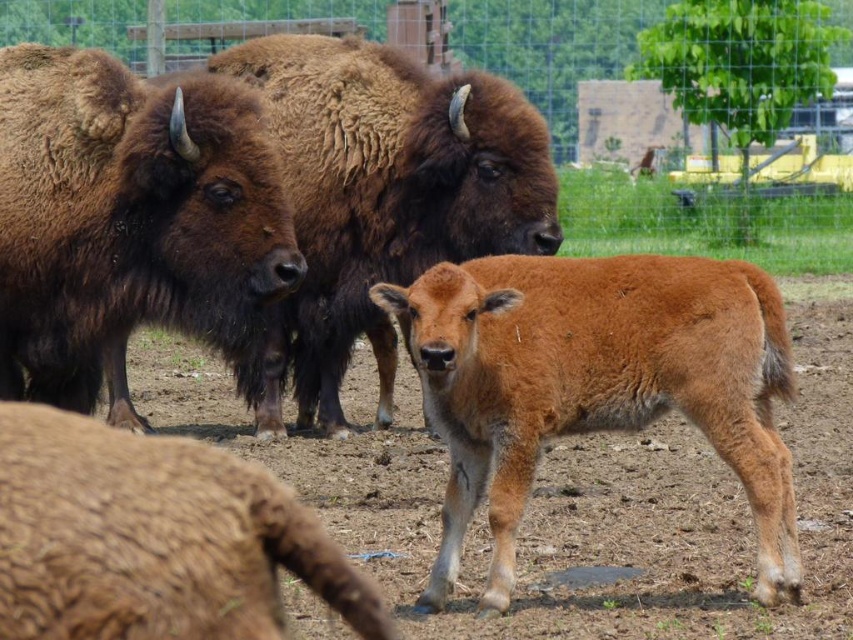
Question: Considering the relative positions of brown furry calf at center and brown furry bison at center in the image provided, where is brown furry calf at center located with respect to brown furry bison at center?

Choices:
 (A) below
 (B) above

Answer: (A)

Question: Which of these objects is positioned closest to the brown furry bison at center?

Choices:
 (A) brown fuzzy bison at upper left
 (B) brown fuzzy calf at center

Answer: (A)

Question: Which of these objects is positioned farthest from the brown fuzzy bison at upper left?

Choices:
 (A) brown furry calf at center
 (B) wire mesh fence at upper center
 (C) brown fuzzy calf at center
 (D) brown furry bison at center

Answer: (B)

Question: Is brown furry bison at center below brown fuzzy calf at center?

Choices:
 (A) yes
 (B) no

Answer: (B)

Question: Which point is farther to the camera?

Choices:
 (A) (180, 310)
 (B) (407, 76)
 (C) (503, 28)
 (D) (64, 422)

Answer: (C)

Question: Is brown furry calf at center smaller than wire mesh fence at upper center?

Choices:
 (A) no
 (B) yes

Answer: (A)